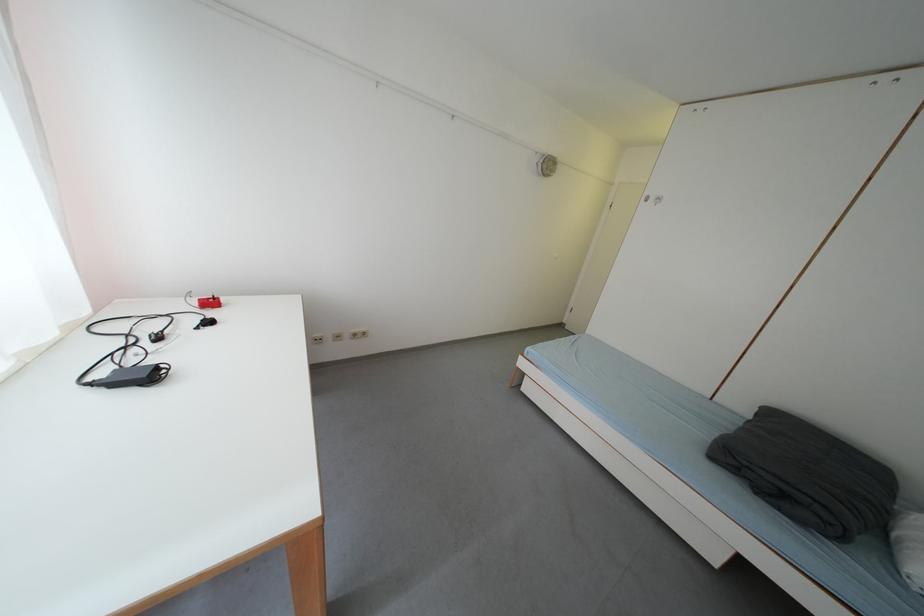
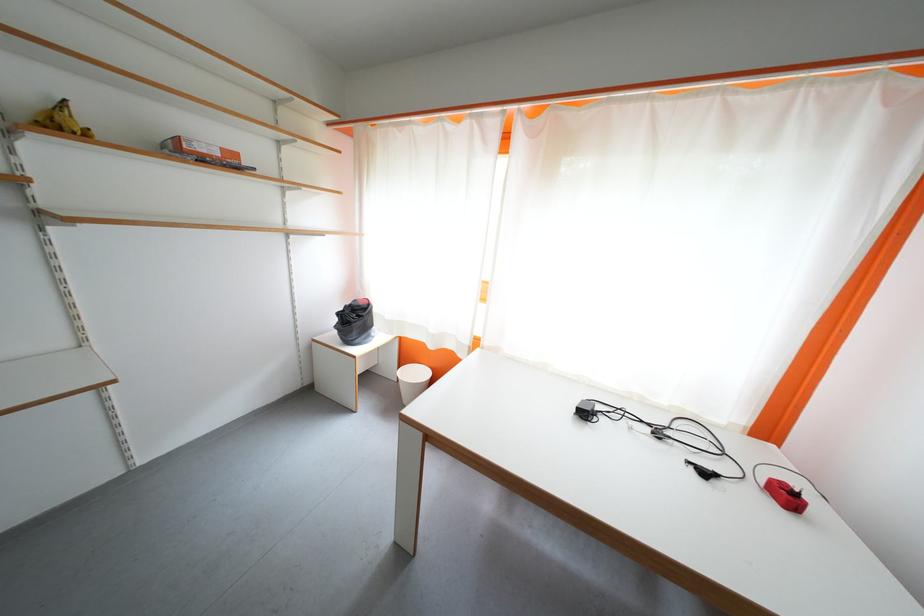
The point at (x=220, y=306) is marked in the first image. Where is the corresponding point in the second image?

(796, 500)